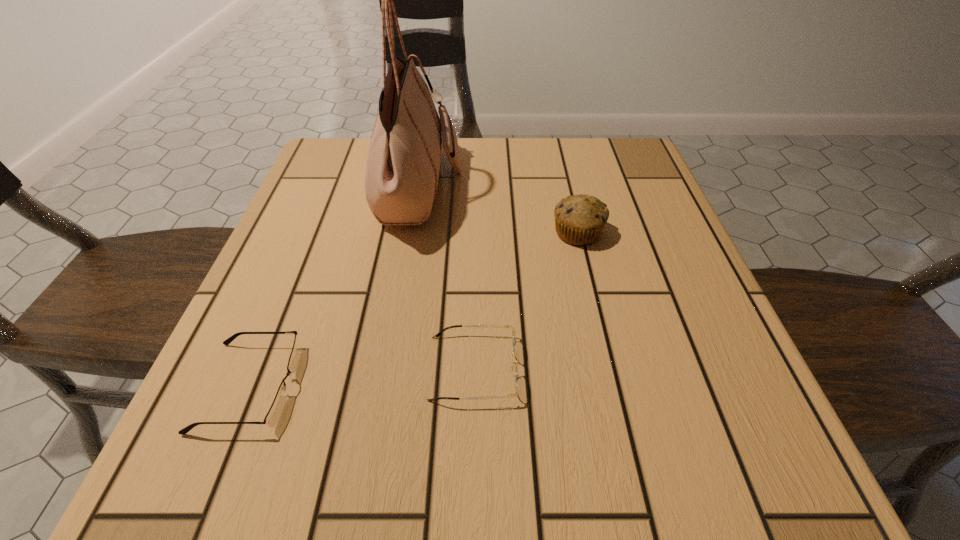
At what (x,y) coordinates should I click in order to perform the action: click on the tallest object. Please return your answer as a coordinate pair (x, y). This screenshot has height=540, width=960. Looking at the image, I should click on [403, 163].

Where is `muffin`? muffin is located at coordinates (579, 219).

Locate an element on the screen. Image resolution: width=960 pixels, height=540 pixels. the second tallest object is located at coordinates (579, 219).

Locate an element on the screen. The image size is (960, 540). the right spectacles is located at coordinates tap(515, 352).

This screenshot has height=540, width=960. Identify the location of the leftmost object. (271, 419).

The width and height of the screenshot is (960, 540). Find the location of `vacant point located 0.160m on the side of the handbag with the attached pouch`. vacant point located 0.160m on the side of the handbag with the attached pouch is located at coordinates (533, 188).

This screenshot has height=540, width=960. In order to click on vacant space located on the right of the rightmost object in this screenshot , I will do `click(669, 233)`.

Locate an element on the screen. The height and width of the screenshot is (540, 960). free location located 0.320m on the lenses of the right spectacles is located at coordinates (732, 368).

Locate an element on the screen. free spot located 0.130m on the front-facing side of the leftmost object is located at coordinates (385, 387).

I want to click on object that is at the far edge, so coord(403,163).